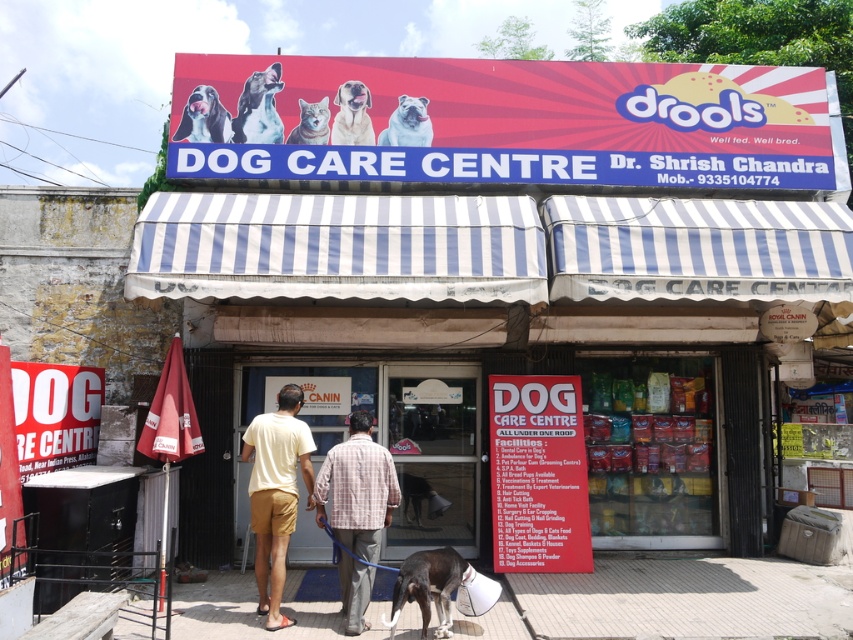
Between point (242, 128) and point (339, 144), which one is positioned behind?

Positioned behind is point (339, 144).

Can you confirm if smooth white dog at upper center is bigger than smooth beige dog at center?

Yes.

Which is in front, point (271, 108) or point (369, 102)?

Point (271, 108) is more forward.

This screenshot has height=640, width=853. Find the location of `smooth white dog at upper center`. smooth white dog at upper center is located at coordinates (259, 108).

Which is below, white striped awning at center or fluffy white cat at center?

white striped awning at center is below.

Describe the element at coordinates (509, 266) in the screenshot. The height and width of the screenshot is (640, 853). I see `white striped awning at center` at that location.

The image size is (853, 640). Find the location of `white striped awning at center`. white striped awning at center is located at coordinates (509, 266).

Find the location of `white striped awning at center`. white striped awning at center is located at coordinates (509, 266).

The height and width of the screenshot is (640, 853). What are the coordinates of `white striped awning at center` in the screenshot? It's located at (509, 266).

Does white striped awning at center appear on the right side of black smooth dog at lower center?

Correct, you'll find white striped awning at center to the right of black smooth dog at lower center.

Identify the location of white striped awning at center. (509, 266).

Identify the location of white striped awning at center. (509, 266).